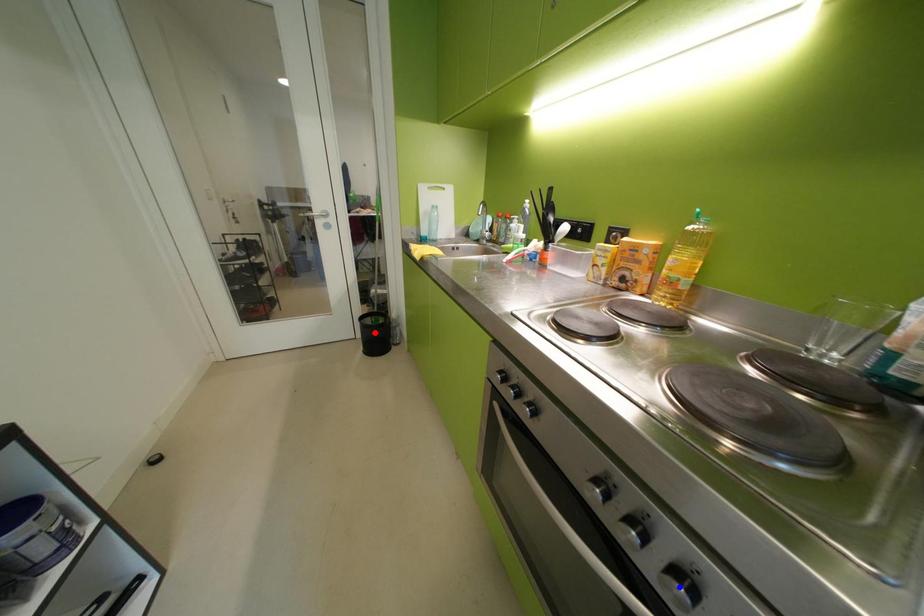
Question: Two points are marked on the image. Which point is closer to the camera?

Choices:
 (A) Blue point is closer.
 (B) Red point is closer.

Answer: (A)